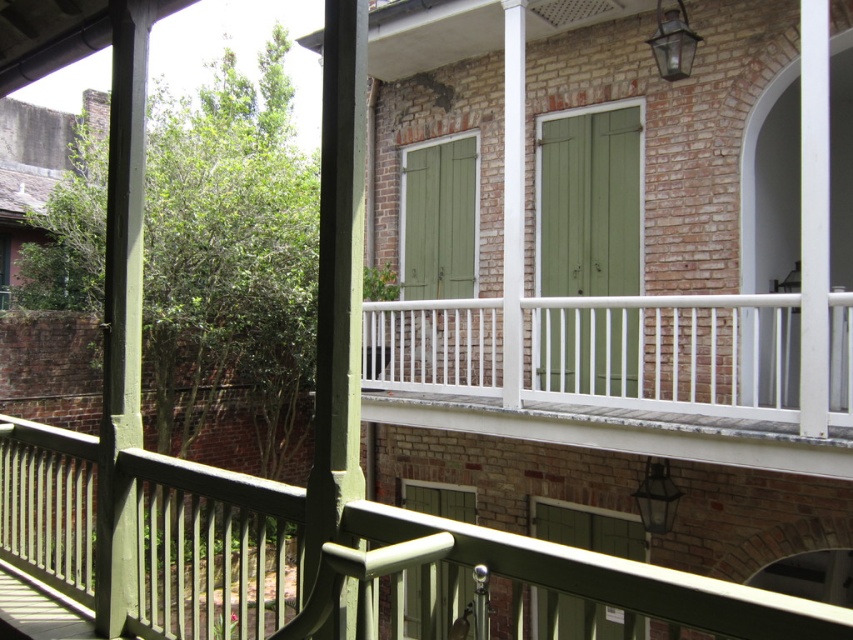
You are a painter standing on the balcony and need to reach both the green matte shutters at center and the green matte shutter at lower center. Your ladder can extend up to 3 meters. Can you safely reach both shutters with your ladder?

The distance between the green matte shutters at center and the green matte shutter at lower center is 3.03 meters. Since the ladder can only extend up to 3 meters, it is slightly shorter than the required distance. Therefore, you cannot safely reach both shutters with your ladder.

You are standing on the balcony of this historic building and want to hang a small potted plant. The potted plant is 30 cm in diameter. Which object between the white painted wood balustrade at center and the green matte shutters at center would provide enough space for the plant?

The white painted wood balustrade at center is larger in size than the green matte shutters at center, so the white painted wood balustrade at center would provide enough space for the 30 cm diameter potted plant.